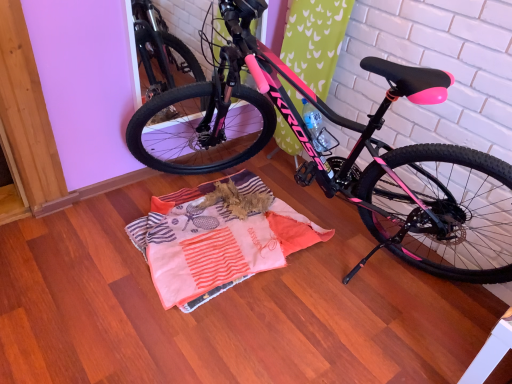
What do you see at coordinates (341, 157) in the screenshot? I see `pink matte bicycle at center` at bounding box center [341, 157].

Locate an element on the screen. The width and height of the screenshot is (512, 384). pink matte bicycle at center is located at coordinates pyautogui.click(x=341, y=157).

The image size is (512, 384). Find the location of `striped cotton blanket at center`. striped cotton blanket at center is located at coordinates (215, 244).

The image size is (512, 384). What do you see at coordinates (215, 244) in the screenshot?
I see `striped cotton blanket at center` at bounding box center [215, 244].

Locate an element on the screen. pink matte bicycle at center is located at coordinates (341, 157).

Visually, is striped cotton blanket at center positioned to the left or to the right of pink matte bicycle at center?

striped cotton blanket at center is to the left of pink matte bicycle at center.

Is striped cotton blanket at center further to the viewer compared to pink matte bicycle at center?

Yes, striped cotton blanket at center is behind pink matte bicycle at center.

Is point (298, 216) positioned after point (448, 215)?

Yes, it is behind point (448, 215).

Based on the photo, from the image's perspective, would you say striped cotton blanket at center is positioned over pink matte bicycle at center?

Actually, striped cotton blanket at center appears below pink matte bicycle at center in the image.

From a real-world perspective, between striped cotton blanket at center and pink matte bicycle at center, who is vertically higher?

From a 3D spatial view, pink matte bicycle at center is above.

Considering the relative sizes of striped cotton blanket at center and pink matte bicycle at center in the image provided, is striped cotton blanket at center thinner than pink matte bicycle at center?

Correct, the width of striped cotton blanket at center is less than that of pink matte bicycle at center.

Based on the photo, considering the sizes of objects striped cotton blanket at center and pink matte bicycle at center in the image provided, who is shorter, striped cotton blanket at center or pink matte bicycle at center?

Standing shorter between the two is striped cotton blanket at center.

Based on their sizes in the image, would you say striped cotton blanket at center is bigger or smaller than pink matte bicycle at center?

striped cotton blanket at center is smaller than pink matte bicycle at center.

Is pink matte bicycle at center completely or partially inside striped cotton blanket at center?

That's incorrect, pink matte bicycle at center is not inside striped cotton blanket at center.

Is there a large distance between striped cotton blanket at center and pink matte bicycle at center?

No, striped cotton blanket at center is in close proximity to pink matte bicycle at center.

Consider the image. Is pink matte bicycle at center at the back of striped cotton blanket at center?

Correct, striped cotton blanket at center is looking away from pink matte bicycle at center.

Can you tell me how much striped cotton blanket at center and pink matte bicycle at center differ in facing direction?

The angular difference between striped cotton blanket at center and pink matte bicycle at center is 87.9 degrees.

There is a striped cotton blanket at center. At what (x,y) coordinates should I click in order to perform the action: click on bicycle above it (from a real-world perspective). Please return your answer as a coordinate pair (x, y). The image size is (512, 384). Looking at the image, I should click on (341, 157).

In the scene shown: Between pink matte bicycle at center and striped cotton blanket at center, which one appears on the right side from the viewer's perspective?

pink matte bicycle at center.

Does pink matte bicycle at center lie behind striped cotton blanket at center?

No, it is in front of striped cotton blanket at center.

Considering the points (383, 147) and (264, 266), which point is in front, point (383, 147) or point (264, 266)?

The point (383, 147) is closer.

From the image's perspective, who appears lower, pink matte bicycle at center or striped cotton blanket at center?

striped cotton blanket at center.

From a real-world perspective, is pink matte bicycle at center physically below striped cotton blanket at center?

Incorrect, from a real-world perspective, pink matte bicycle at center is higher than striped cotton blanket at center.

Can you confirm if pink matte bicycle at center is thinner than striped cotton blanket at center?

No.

Is pink matte bicycle at center taller or shorter than striped cotton blanket at center?

In the image, pink matte bicycle at center appears to be taller than striped cotton blanket at center.

Based on the photo, considering the relative sizes of pink matte bicycle at center and striped cotton blanket at center in the image provided, is pink matte bicycle at center smaller than striped cotton blanket at center?

No, pink matte bicycle at center is not smaller than striped cotton blanket at center.

Based on the photo, could striped cotton blanket at center be considered to be inside pink matte bicycle at center?

Yes, pink matte bicycle at center is surrounding striped cotton blanket at center.

Can you see pink matte bicycle at center touching striped cotton blanket at center?

No, pink matte bicycle at center is not in contact with striped cotton blanket at center.

Is pink matte bicycle at center oriented away from striped cotton blanket at center?

No, pink matte bicycle at center's orientation is not away from striped cotton blanket at center.

How many degrees apart are the facing directions of pink matte bicycle at center and striped cotton blanket at center?

They differ by 87.9 degrees in their facing directions.

Where is `bicycle that appears in front of the striped cotton blanket at center`? Image resolution: width=512 pixels, height=384 pixels. bicycle that appears in front of the striped cotton blanket at center is located at coordinates (341, 157).

Where is `blanket below the pink matte bicycle at center (from the image's perspective)`? This screenshot has height=384, width=512. blanket below the pink matte bicycle at center (from the image's perspective) is located at coordinates (215, 244).

You are a GUI agent. You are given a task and a screenshot of the screen. Output one action in this format:
    pyautogui.click(x=<x>, y=<y>)
    Task: Click on the blanket below the pink matte bicycle at center (from a real-world perspective)
    The image size is (512, 384).
    Given the screenshot: What is the action you would take?
    pyautogui.click(x=215, y=244)